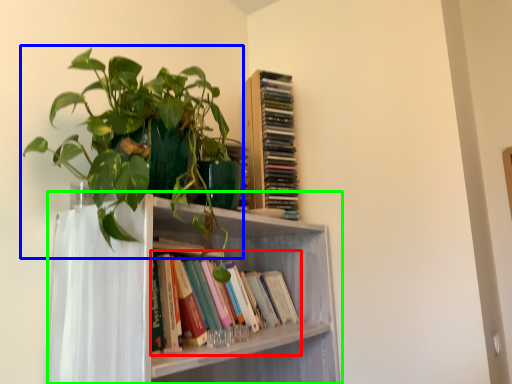
Question: Which is farther away from book (highlighted by a red box)? houseplant (highlighted by a blue box) or shelf (highlighted by a green box)?

Choices:
 (A) houseplant
 (B) shelf

Answer: (A)